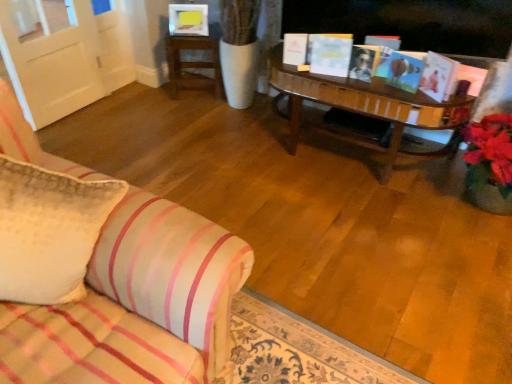
Question: Is white textured pillow at left situated inside white paper book at center, arranged as the second book when viewed from the right, or outside?

Choices:
 (A) inside
 (B) outside

Answer: (B)

Question: From the image's perspective, is white textured pillow at left located above or below white paper book at center, arranged as the second book when viewed from the right?

Choices:
 (A) below
 (B) above

Answer: (A)

Question: Which is farther from the white paper book at center, which is counted as the second book, starting from the left?

Choices:
 (A) matte pink book at upper right, which is the 1th book from right to left
 (B) wooden table at upper center
 (C) white matte book at upper center, marked as the third book in a right-to-left arrangement
 (D) white textured pillow at left

Answer: (D)

Question: Estimate the real-world distances between objects in this image. Which object is closer to the matte pink book at upper right, which ranks as the 3th book in left-to-right order?

Choices:
 (A) white textured pillow at left
 (B) white paper book at center, arranged as the second book when viewed from the right
 (C) white matte book at upper center, which is counted as the first book, starting from the left
 (D) wooden table at upper center

Answer: (B)